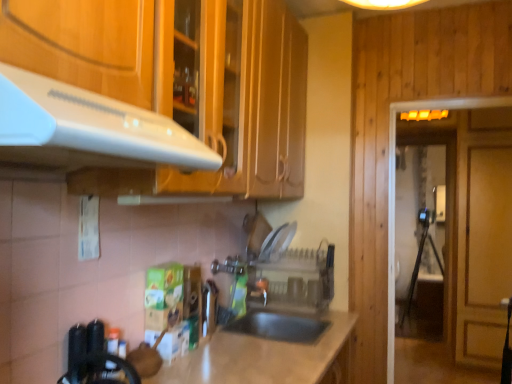
Question: Is white glossy exhaust hood at upper left facing towards clear plastic dish rack at center?

Choices:
 (A) no
 (B) yes

Answer: (A)

Question: From a real-world perspective, is white glossy exhaust hood at upper left located beneath clear plastic dish rack at center?

Choices:
 (A) no
 (B) yes

Answer: (A)

Question: Is white glossy exhaust hood at upper left looking in the opposite direction of clear plastic dish rack at center?

Choices:
 (A) no
 (B) yes

Answer: (A)

Question: Does white glossy exhaust hood at upper left appear on the left side of clear plastic dish rack at center?

Choices:
 (A) no
 (B) yes

Answer: (B)

Question: From the image's perspective, would you say white glossy exhaust hood at upper left is shown under clear plastic dish rack at center?

Choices:
 (A) no
 (B) yes

Answer: (A)

Question: Does white glossy exhaust hood at upper left come in front of clear plastic dish rack at center?

Choices:
 (A) yes
 (B) no

Answer: (A)

Question: Is transparent glass door at right, the first glass door in the back-to-front sequence, positioned far away from metallic silver faucet at center?

Choices:
 (A) yes
 (B) no

Answer: (A)

Question: Considering the relative sizes of transparent glass door at right, arranged as the second glass door when viewed from the front, and metallic silver faucet at center in the image provided, is transparent glass door at right, arranged as the second glass door when viewed from the front, wider than metallic silver faucet at center?

Choices:
 (A) no
 (B) yes

Answer: (B)

Question: From the image's perspective, is transparent glass door at right, the second glass door positioned from the left, over metallic silver faucet at center?

Choices:
 (A) yes
 (B) no

Answer: (A)

Question: Is transparent glass door at right, which ranks as the 1th glass door in right-to-left order, behind metallic silver faucet at center?

Choices:
 (A) no
 (B) yes

Answer: (B)

Question: From a real-world perspective, is transparent glass door at right, arranged as the second glass door when viewed from the front, physically above metallic silver faucet at center?

Choices:
 (A) no
 (B) yes

Answer: (B)

Question: Does transparent glass door at right, the second glass door positioned from the left, turn towards metallic silver faucet at center?

Choices:
 (A) yes
 (B) no

Answer: (B)

Question: Is transparent glass door at right, which ranks as the 1th glass door in right-to-left order, oriented away from clear plastic dish rack at center?

Choices:
 (A) no
 (B) yes

Answer: (A)